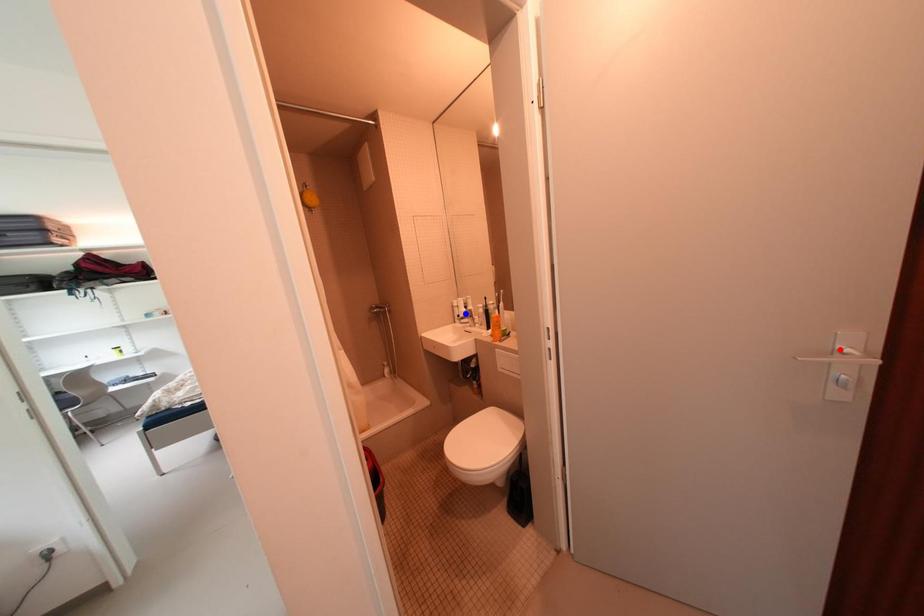
Question: Which of the two points in the image is closer to the camera?

Choices:
 (A) Blue point is closer.
 (B) Red point is closer.

Answer: (B)